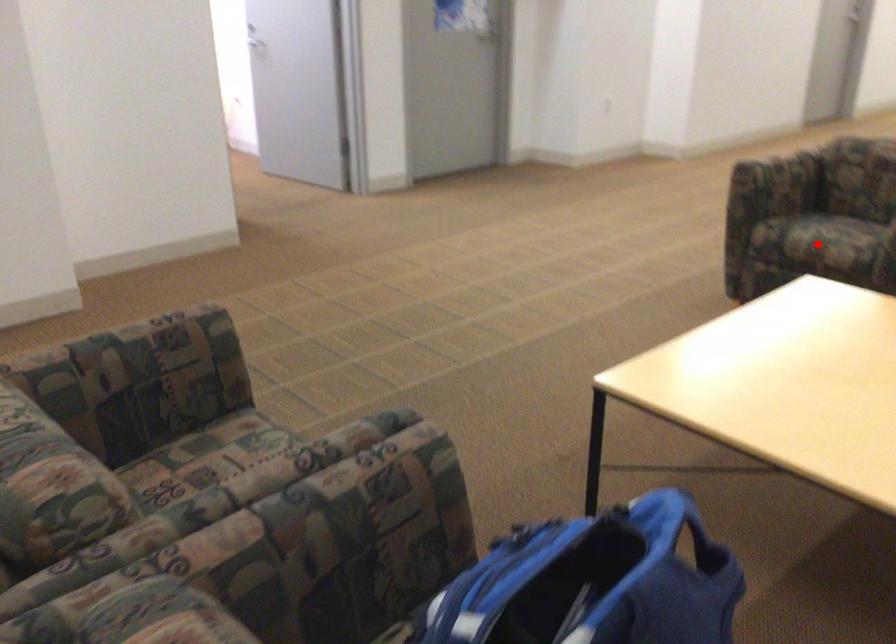
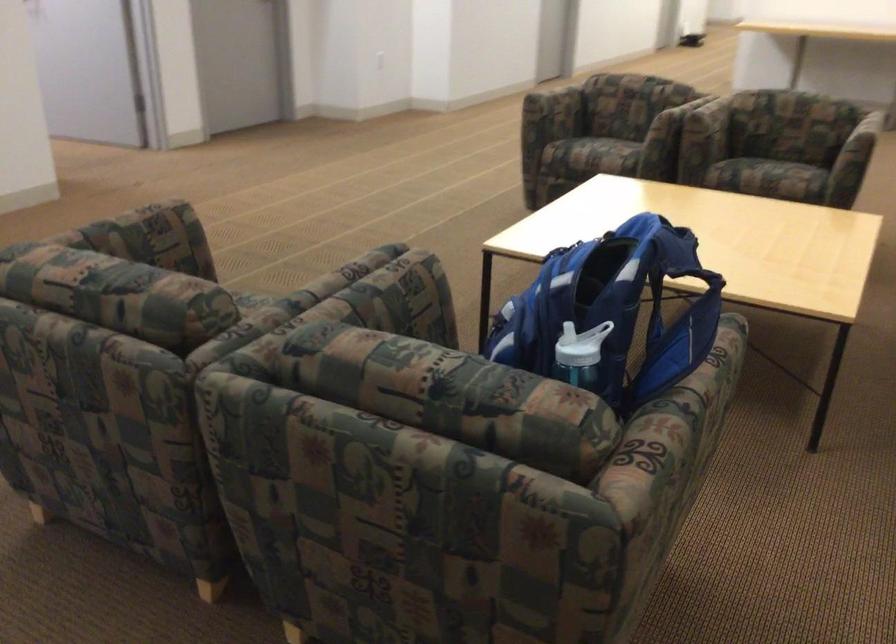
Locate, in the second image, the point that corresponds to the highlighted location in the first image.

(597, 152)